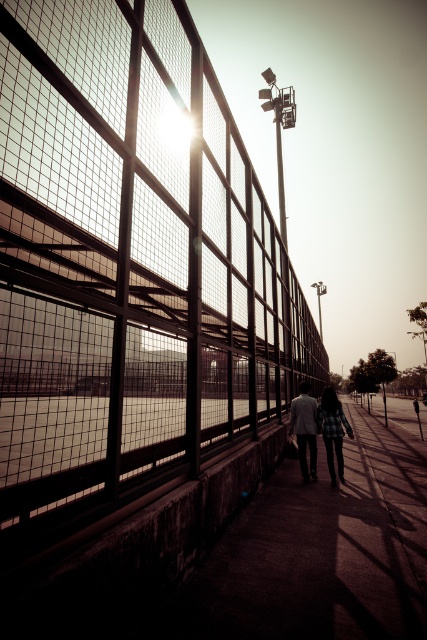
You are standing at the point marked as point (333, 406) on the sidewalk near the industrial fence. A friend is approaching you from the direction of the floodlights in the background. If your friend walks at a steady pace of 1.5 meters per second, how many seconds will it take for them to reach you?

The distance between the point (333, 406) and the viewer is 8.58 meters. Since your friend is approaching from the direction of the floodlights and walking towards you at 1.5 meters per second, it will take them 8.58 divided by 1.5, which equals approximately 5.72 seconds to reach you.